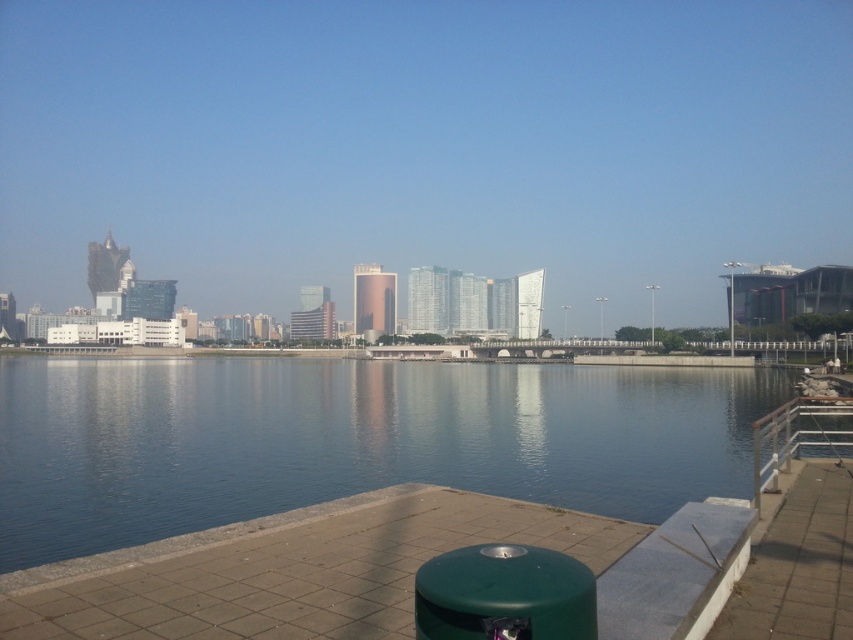
You are standing at the waterfront and want to take a photo of the city skyline. You notice a point marked at coordinates point [350,440]. What is located at that point?

The point [350,440] marks blue glassy water at center.

You are a photographer planning to capture the city skyline reflected in the blue glassy water at center. However, you notice the silver metallic railing at lower right might block part of the reflection. Based on their sizes, can you determine if the railing will fit within the frame without overlapping the reflection?

The blue glassy water at center is bigger than the silver metallic railing at lower right, so the silver metallic railing at lower right will fit within the frame without overlapping the reflection.

You are a tourist standing on the walkway and want to take a photo of the city skyline. You have a camera with a wide angle lens. The silver metallic railing at lower right is blocking your view. Can you move to the left or right to avoid it and still see the blue glassy water at center in your shot?

The blue glassy water at center is positioned on the left side of the silver metallic railing at lower right. To avoid the railing, you can move to the left side of the silver metallic railing at lower right so that the blue glassy water at center remains in view while the railing is no longer blocking the skyline.